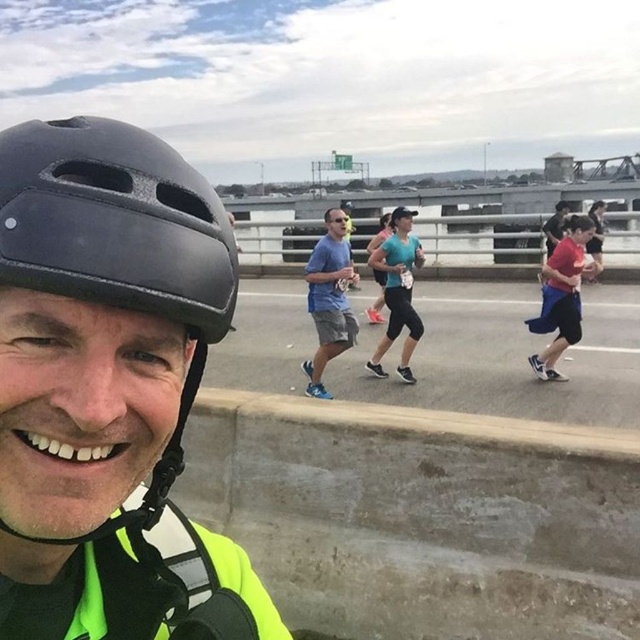
Question: Considering the relative positions of black matte helmet at left and black matte sunglasses at center in the image provided, where is black matte helmet at left located with respect to black matte sunglasses at center?

Choices:
 (A) left
 (B) right

Answer: (A)

Question: Which object is positioned farthest from the matte black helmet at center?

Choices:
 (A) blue fabric shirt at center
 (B) matte blue shirt at center

Answer: (B)

Question: Among these points, which one is farthest from the camera?

Choices:
 (A) (344, 221)
 (B) (97, 204)
 (C) (538, 364)
 (D) (339, 214)

Answer: (C)

Question: Which is farther from the black matte sunglasses at center?

Choices:
 (A) black matte helmet at left
 (B) matte black helmet at center
 (C) blue fabric shirt at center
 (D) matte blue shirt at center

Answer: (D)

Question: Can you confirm if black matte helmet at left is smaller than blue fabric shirt at center?

Choices:
 (A) no
 (B) yes

Answer: (B)

Question: Where is red fabric shorts at right located in relation to black matte sunglasses at center in the image?

Choices:
 (A) below
 (B) above

Answer: (A)